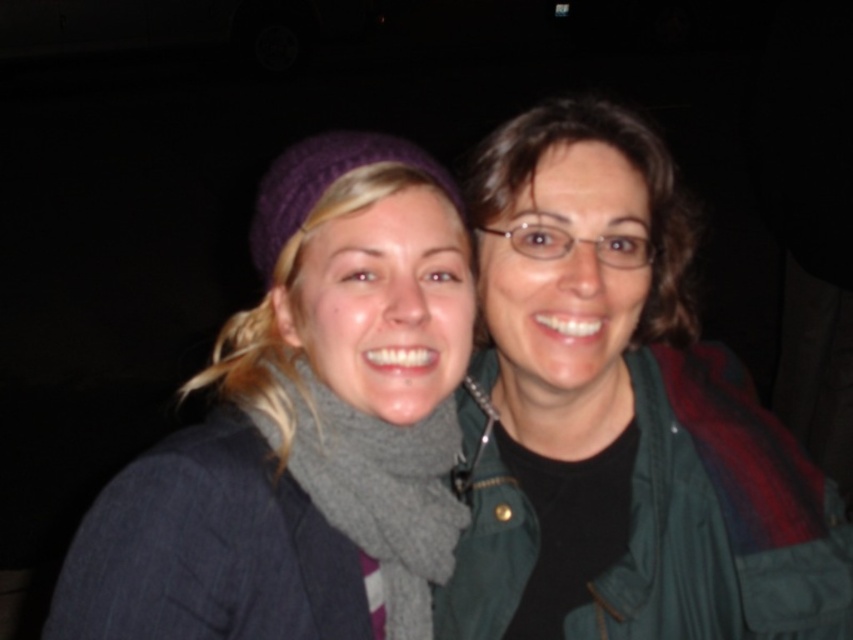
You are taking a photo of two friends in a dark setting. You notice two points of light in the image at coordinates point (548, 544) and point (419, 220). Which point is closer to the camera?

Point (419, 220) is closer to the camera because point (548, 544) is further away from the camera than point (419, 220).

Consider the image. You are a photographer trying to capture a group photo of two people. You have a camera that can only focus on subjects within a 28 inch range. Given the distance between the green matte jacket at center and the other person, will your camera be able to focus on both of them simultaneously?

The two individuals are 30.87 inches apart, which exceeds the camera focus range of 28 inches. Therefore, the camera cannot focus on both the green matte jacket at center and the other person at the same time.

You are a photographer trying to capture a closeup of the gray woolen scarf at center without the green matte jacket at center blocking the view. Is it possible to do so while keeping both subjects in frame?

The green matte jacket at center is positioned over the gray woolen scarf at center, so it would block the view of the scarf. To capture the scarf without obstruction, you would need to adjust the angle or position to ensure the jacket is not covering it while still including both subjects in the frame.